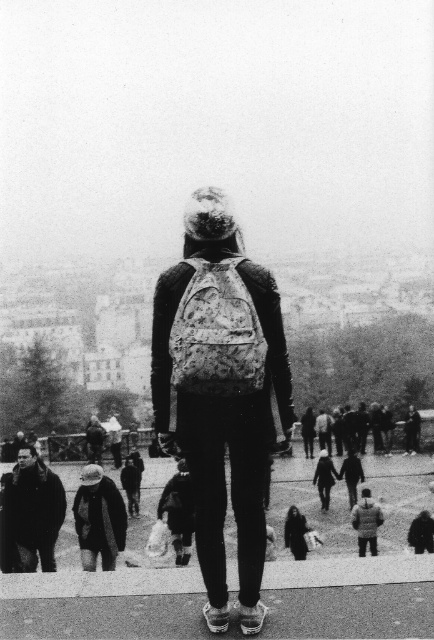
Question: Is floral-patterned backpack at center in front of dark gray wool coat at lower center?

Choices:
 (A) no
 (B) yes

Answer: (B)

Question: In this image, where is dark brown leather jacket at lower left located relative to dark gray woolen hat at lower left?

Choices:
 (A) right
 (B) left

Answer: (B)

Question: Which point appears closest to the camera in this image?

Choices:
 (A) pos(81,556)
 (B) pos(20,536)

Answer: (B)

Question: Which object is positioned farthest from the floral-patterned backpack at center?

Choices:
 (A) dark gray woolen hat at lower left
 (B) dark brown leather jacket at lower left

Answer: (B)

Question: Does dark brown leather jacket at lower left have a lesser width compared to dark gray woolen hat at lower left?

Choices:
 (A) yes
 (B) no

Answer: (A)

Question: Which of the following is the farthest from the observer?

Choices:
 (A) (7, 538)
 (B) (82, 532)
 (C) (292, 534)

Answer: (C)